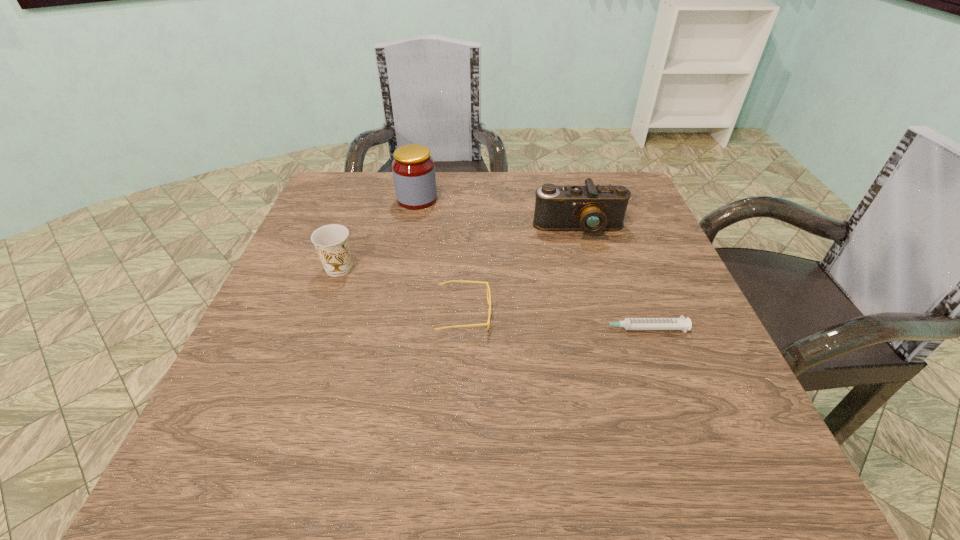
Where is `vacant area that lies between the syringe and the spectacles`? The width and height of the screenshot is (960, 540). vacant area that lies between the syringe and the spectacles is located at coordinates (552, 321).

Locate an element on the screen. This screenshot has width=960, height=540. vacant region between the third tallest object and the third object from right to left is located at coordinates (401, 291).

Identify the location of vacant area that lies between the camera and the tallest object. The width and height of the screenshot is (960, 540). (498, 214).

Identify the location of free space between the third shortest object and the spectacles. (401, 291).

You are a GUI agent. You are given a task and a screenshot of the screen. Output one action in this format:
    pyautogui.click(x=<x>, y=<y>)
    Task: Click on the vacant space that is in between the fourth nearest object and the tallest object
    Image resolution: width=960 pixels, height=540 pixels.
    Given the screenshot: What is the action you would take?
    pyautogui.click(x=498, y=214)

I want to click on free spot between the tallest object and the spectacles, so click(441, 256).

At what (x,y) coordinates should I click in order to perform the action: click on vacant area that lies between the leftmost object and the farthest object. Please return your answer as a coordinate pair (x, y). The width and height of the screenshot is (960, 540). Looking at the image, I should click on (378, 234).

This screenshot has width=960, height=540. In order to click on free point between the fourth nearest object and the shortest object in this screenshot , I will do `click(609, 279)`.

At what (x,y) coordinates should I click in order to perform the action: click on object that can be found as the second closest to the shortest object. Please return your answer as a coordinate pair (x, y). Looking at the image, I should click on (591, 209).

Identify which object is the fourth closest to the syringe. Please provide its 2D coordinates. Your answer should be formatted as a tuple, i.e. [(x, y)], where the tuple contains the x and y coordinates of a point satisfying the conditions above.

[(413, 168)]